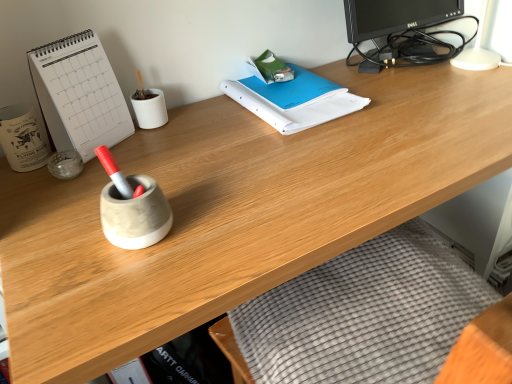
Question: Are transparent glass jar at left, which appears as the second stationery when viewed from the left, and black glossy monitor at upper right far apart?

Choices:
 (A) yes
 (B) no

Answer: (B)

Question: Is black glossy monitor at upper right at the back of transparent glass jar at left, arranged as the 1th stationery when viewed from the right?

Choices:
 (A) no
 (B) yes

Answer: (A)

Question: Considering the relative sizes of transparent glass jar at left, arranged as the 1th stationery when viewed from the right, and black glossy monitor at upper right in the image provided, is transparent glass jar at left, arranged as the 1th stationery when viewed from the right, shorter than black glossy monitor at upper right?

Choices:
 (A) yes
 (B) no

Answer: (A)

Question: Does transparent glass jar at left, which appears as the second stationery when viewed from the left, appear on the right side of black glossy monitor at upper right?

Choices:
 (A) no
 (B) yes

Answer: (A)

Question: Can you confirm if transparent glass jar at left, arranged as the 1th stationery when viewed from the right, is wider than black glossy monitor at upper right?

Choices:
 (A) yes
 (B) no

Answer: (B)

Question: Considering the relative positions of transparent glass jar at left, which appears as the second stationery when viewed from the left, and black glossy monitor at upper right in the image provided, is transparent glass jar at left, which appears as the second stationery when viewed from the left, to the left of black glossy monitor at upper right from the viewer's perspective?

Choices:
 (A) no
 (B) yes

Answer: (B)

Question: Does transparent glass jar at left, arranged as the 1th stationery when viewed from the right, have a lesser height compared to white paper at left?

Choices:
 (A) yes
 (B) no

Answer: (A)

Question: From the image's perspective, is transparent glass jar at left, which appears as the second stationery when viewed from the left, beneath white paper at left?

Choices:
 (A) yes
 (B) no

Answer: (A)

Question: Can you confirm if transparent glass jar at left, arranged as the 1th stationery when viewed from the right, is bigger than white paper at left?

Choices:
 (A) yes
 (B) no

Answer: (B)

Question: From a real-world perspective, is transparent glass jar at left, which appears as the second stationery when viewed from the left, over white paper at left?

Choices:
 (A) yes
 (B) no

Answer: (B)

Question: From a real-world perspective, does transparent glass jar at left, which appears as the second stationery when viewed from the left, sit lower than white paper at left?

Choices:
 (A) no
 (B) yes

Answer: (B)

Question: Is transparent glass jar at left, arranged as the 1th stationery when viewed from the right, taller than white paper at left?

Choices:
 (A) no
 (B) yes

Answer: (A)

Question: Considering the relative sizes of blue paper binder at center and transparent glass jar at left, arranged as the 1th stationery when viewed from the right, in the image provided, is blue paper binder at center thinner than transparent glass jar at left, arranged as the 1th stationery when viewed from the right,?

Choices:
 (A) no
 (B) yes

Answer: (A)